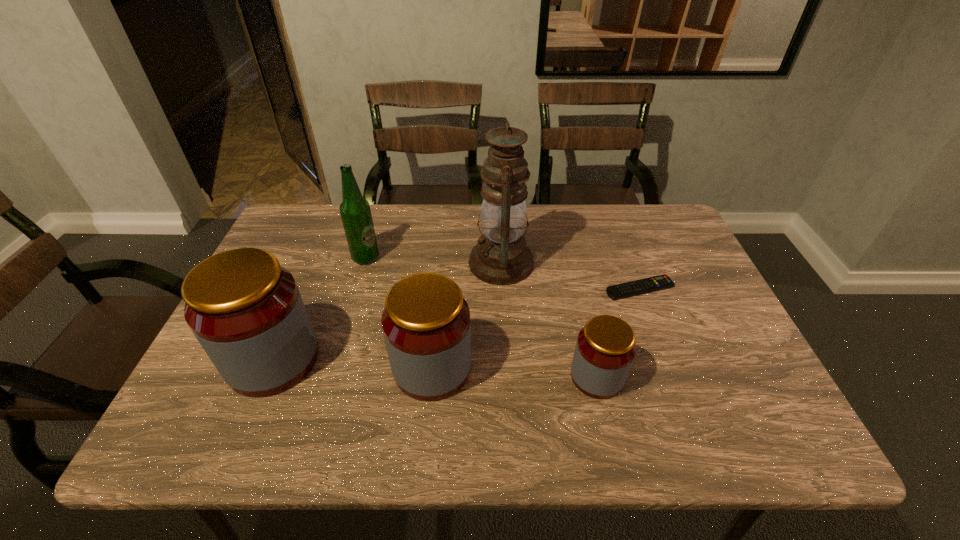
All jars are currently evenly spaced. To continue this pattern, where would you add another jar on the right? Please point out a vacant spot. Please provide its 2D coordinates. Your answer should be formatted as a tuple, i.e. [(x, y)], where the tuple contains the x and y coordinates of a point satisfying the conditions above.

[(767, 386)]